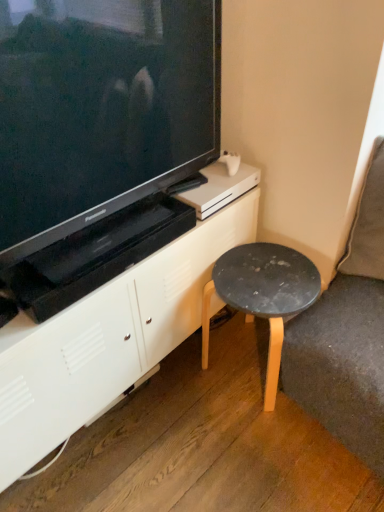
Question: Can you confirm if black matte stool at lower right is shorter than matte black television at upper left?

Choices:
 (A) no
 (B) yes

Answer: (B)

Question: Is black matte stool at lower right aimed at matte black television at upper left?

Choices:
 (A) yes
 (B) no

Answer: (B)

Question: Is black matte stool at lower right not within matte black television at upper left?

Choices:
 (A) no
 (B) yes

Answer: (B)

Question: From a real-world perspective, is black matte stool at lower right positioned under matte black television at upper left based on gravity?

Choices:
 (A) yes
 (B) no

Answer: (A)

Question: Can matte black television at upper left be found inside black matte stool at lower right?

Choices:
 (A) no
 (B) yes

Answer: (A)

Question: Based on their sizes in the image, would you say white matte cabinet at center is bigger or smaller than matte black television at upper left?

Choices:
 (A) big
 (B) small

Answer: (A)

Question: Looking at their shapes, would you say white matte cabinet at center is wider or thinner than matte black television at upper left?

Choices:
 (A) thin
 (B) wide

Answer: (B)

Question: Is white matte cabinet at center to the left or to the right of matte black television at upper left in the image?

Choices:
 (A) left
 (B) right

Answer: (A)

Question: Is white matte cabinet at center in front of or behind matte black television at upper left in the image?

Choices:
 (A) behind
 (B) front

Answer: (A)

Question: From the image's perspective, relative to black matte stool at lower right, is white matte cabinet at center above or below?

Choices:
 (A) above
 (B) below

Answer: (A)

Question: Would you say white matte cabinet at center is inside or outside black matte stool at lower right?

Choices:
 (A) outside
 (B) inside

Answer: (A)

Question: Is white matte cabinet at center bigger or smaller than black matte stool at lower right?

Choices:
 (A) small
 (B) big

Answer: (B)

Question: Is white matte cabinet at center in front of or behind black matte stool at lower right in the image?

Choices:
 (A) behind
 (B) front

Answer: (B)

Question: Relative to white matte cabinet at center, is matte black television at upper left in front or behind?

Choices:
 (A) behind
 (B) front

Answer: (B)

Question: From the image's perspective, is matte black television at upper left positioned above or below white matte cabinet at center?

Choices:
 (A) below
 (B) above

Answer: (B)